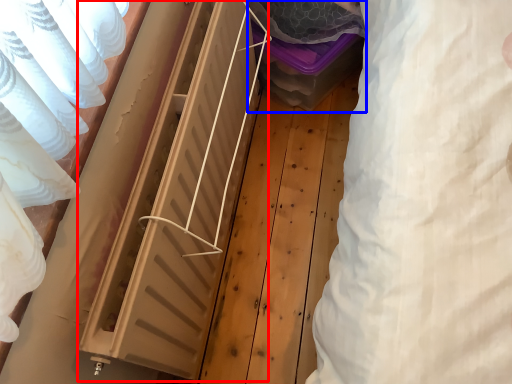
Question: Which point is further to the camera, radiator (highlighted by a red box) or storage box (highlighted by a blue box)?

Choices:
 (A) radiator
 (B) storage box

Answer: (B)